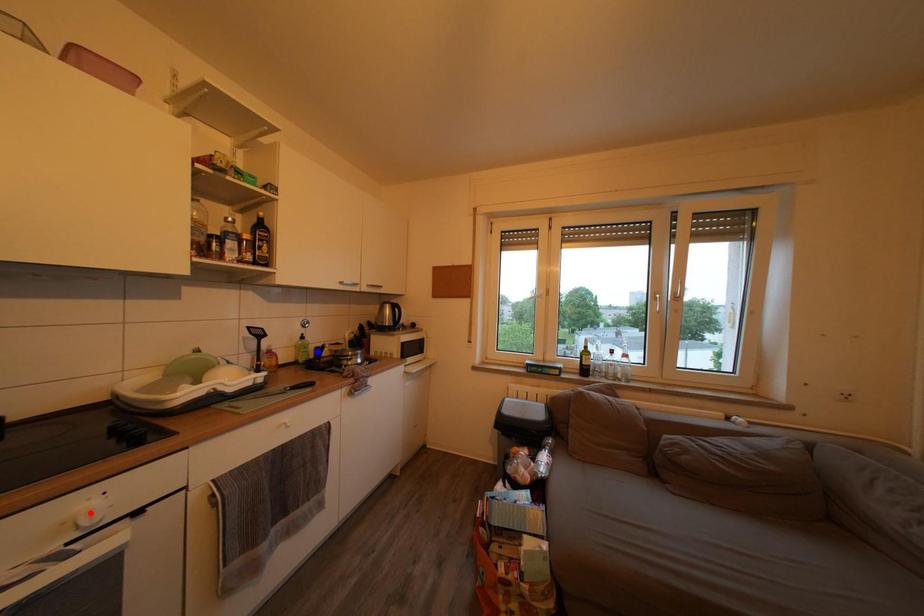
Question: Two points are marked on the image. Which point is closer to the camera?

Choices:
 (A) Blue point is closer.
 (B) Red point is closer.

Answer: (B)